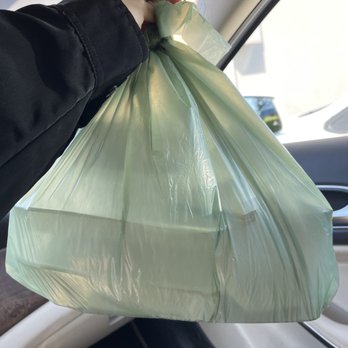
Where is `handle`? This screenshot has height=348, width=348. handle is located at coordinates (341, 215).